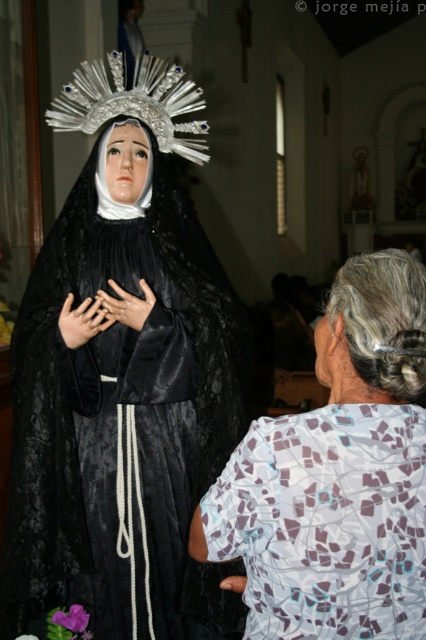
Question: Which point appears farthest from the camera in this image?

Choices:
 (A) (385, 406)
 (B) (218, 296)

Answer: (B)

Question: Which point is farther from the camera taking this photo?

Choices:
 (A) (365, 600)
 (B) (101, 452)

Answer: (B)

Question: Is matte black statue at center positioned at the back of printed fabric blouse at lower right?

Choices:
 (A) no
 (B) yes

Answer: (B)

Question: Does matte black statue at center have a larger size compared to printed fabric blouse at lower right?

Choices:
 (A) no
 (B) yes

Answer: (B)

Question: Which point is farther to the camera?

Choices:
 (A) (x=382, y=401)
 (B) (x=75, y=298)

Answer: (B)

Question: Is matte black statue at center closer to the viewer compared to printed fabric blouse at lower right?

Choices:
 (A) no
 (B) yes

Answer: (A)